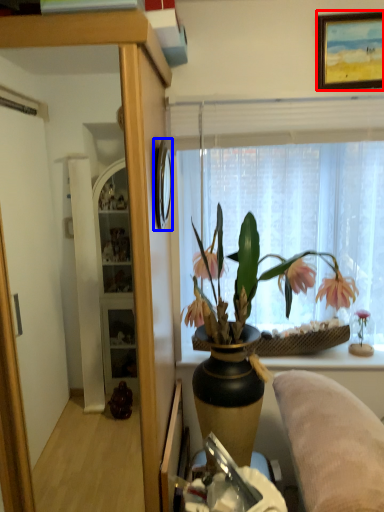
Question: Which of the following is the closest to the observer, picture frame (highlighted by a red box) or picture frame (highlighted by a blue box)?

Choices:
 (A) picture frame
 (B) picture frame

Answer: (B)